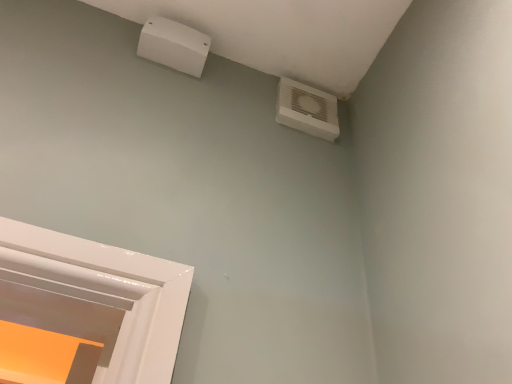
The image size is (512, 384). In order to click on white plastic air conditioning unit at upper right in this screenshot , I will do `click(307, 109)`.

The height and width of the screenshot is (384, 512). What do you see at coordinates (307, 109) in the screenshot?
I see `white plastic air conditioning unit at upper right` at bounding box center [307, 109].

Where is `white plastic outlet at upper center`? This screenshot has height=384, width=512. white plastic outlet at upper center is located at coordinates (174, 45).

Describe the element at coordinates (174, 45) in the screenshot. I see `white plastic outlet at upper center` at that location.

In order to face white plastic outlet at upper center, should I rotate leftwards or rightwards?

Turn left by 10.272 degrees to look at white plastic outlet at upper center.

Where is `white plastic air conditioning unit at upper right`? Image resolution: width=512 pixels, height=384 pixels. white plastic air conditioning unit at upper right is located at coordinates (307, 109).

Between white plastic air conditioning unit at upper right and white plastic outlet at upper center, which one appears on the right side from the viewer's perspective?

Positioned to the right is white plastic air conditioning unit at upper right.

Which is in front, white plastic air conditioning unit at upper right or white plastic outlet at upper center?

white plastic outlet at upper center is closer to the camera.

Which is in front, point (336, 133) or point (156, 42)?

The point (156, 42) is in front.

From the image's perspective, relative to white plastic outlet at upper center, is white plastic air conditioning unit at upper right above or below?

white plastic air conditioning unit at upper right is below white plastic outlet at upper center.

From a real-world perspective, who is located lower, white plastic air conditioning unit at upper right or white plastic outlet at upper center?

white plastic air conditioning unit at upper right, from a real-world perspective.

Considering the relative sizes of white plastic air conditioning unit at upper right and white plastic outlet at upper center in the image provided, is white plastic air conditioning unit at upper right wider than white plastic outlet at upper center?

No, white plastic air conditioning unit at upper right is not wider than white plastic outlet at upper center.

Is white plastic air conditioning unit at upper right shorter than white plastic outlet at upper center?

No.

Does white plastic air conditioning unit at upper right have a larger size compared to white plastic outlet at upper center?

No.

Is white plastic outlet at upper center inside white plastic air conditioning unit at upper right?

No, white plastic outlet at upper center is not surrounded by white plastic air conditioning unit at upper right.

Is white plastic air conditioning unit at upper right directly adjacent to white plastic outlet at upper center?

There is a gap between white plastic air conditioning unit at upper right and white plastic outlet at upper center.

Is white plastic air conditioning unit at upper right oriented away from white plastic outlet at upper center?

white plastic air conditioning unit at upper right is not turned away from white plastic outlet at upper center.

How many degrees apart are the facing directions of white plastic air conditioning unit at upper right and white plastic outlet at upper center?

The angular difference between white plastic air conditioning unit at upper right and white plastic outlet at upper center is 0.589 degrees.

This screenshot has width=512, height=384. In order to click on electric outlet in front of the white plastic air conditioning unit at upper right in this screenshot , I will do 174,45.

In the image, is white plastic outlet at upper center on the left side or the right side of white plastic air conditioning unit at upper right?

In the image, white plastic outlet at upper center appears on the left side of white plastic air conditioning unit at upper right.

Does white plastic outlet at upper center come in front of white plastic air conditioning unit at upper right?

Yes, it is in front of white plastic air conditioning unit at upper right.

Between point (195, 62) and point (303, 87), which one is positioned in front?

The point (195, 62) is more forward.

From the image's perspective, between white plastic outlet at upper center and white plastic air conditioning unit at upper right, who is located below?

From the image's view, white plastic air conditioning unit at upper right is below.

From a real-world perspective, is white plastic outlet at upper center over white plastic air conditioning unit at upper right?

Yes.

Consider the image. Considering the sizes of objects white plastic outlet at upper center and white plastic air conditioning unit at upper right in the image provided, who is thinner, white plastic outlet at upper center or white plastic air conditioning unit at upper right?

Thinner between the two is white plastic air conditioning unit at upper right.

Which of these two, white plastic outlet at upper center or white plastic air conditioning unit at upper right, stands shorter?

white plastic outlet at upper center.

In the scene shown: Who is bigger, white plastic outlet at upper center or white plastic air conditioning unit at upper right?

Bigger between the two is white plastic outlet at upper center.

Would you say white plastic air conditioning unit at upper right is part of white plastic outlet at upper center's contents?

No.

Is white plastic outlet at upper center far away from white plastic air conditioning unit at upper right?

No, white plastic outlet at upper center is not far from white plastic air conditioning unit at upper right.

Could you tell me if white plastic outlet at upper center is facing white plastic air conditioning unit at upper right?

No, white plastic outlet at upper center does not turn towards white plastic air conditioning unit at upper right.

How many degrees apart are the facing directions of white plastic outlet at upper center and white plastic air conditioning unit at upper right?

0.589 degrees separate the facing orientations of white plastic outlet at upper center and white plastic air conditioning unit at upper right.

Find the location of a particular element. air conditioning below the white plastic outlet at upper center (from a real-world perspective) is located at coordinates (x=307, y=109).

This screenshot has height=384, width=512. Identify the location of electric outlet on the left of the white plastic air conditioning unit at upper right. (174, 45).

Identify the location of air conditioning on the right of the white plastic outlet at upper center. (307, 109).